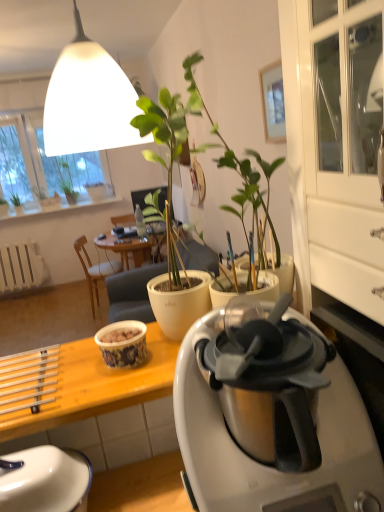
This screenshot has height=512, width=384. What are the coordinates of `free point above yellow wood desk at lower left (from a real-world perspective)` in the screenshot? It's located at (85, 373).